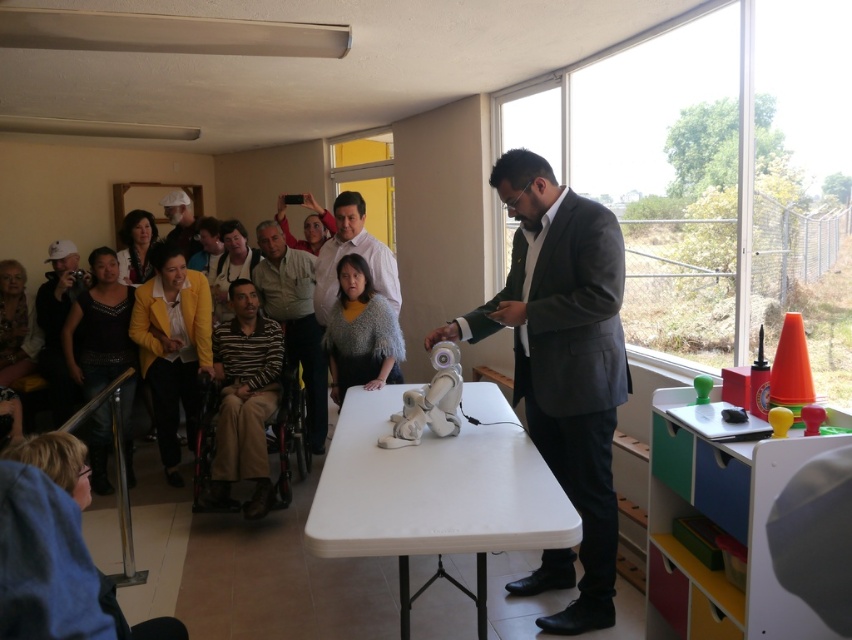
Based on the photo, you are organizing a photo shoot and need to ensure that all participants are visible in the frame. Given that the dark gray suit at center and the striped cotton shirt at center are both in the center, which one might require more space to fully capture in a photograph?

The dark gray suit at center has a larger width than the striped cotton shirt at center, so it would require more space to fully capture in a photograph.

You are a photographer at the event and want to capture a photo of both the striped fabric shirt at center and the matte white cap at upper left in the same frame. Which object should you focus on first to ensure both are in the shot?

The striped fabric shirt at center is positioned on the right side of matte white cap at upper left, so you should focus on the matte white cap at upper left first to ensure both are in the shot.

You are standing in the room where the presentation is happening. You want to hand a document to the person wearing the striped fabric shirt at center. Considering your current position, can you reach them without moving more than 3 meters?

The distance between you and the striped fabric shirt at center is 3.50 meters. Since you can only move 3 meters, you cannot reach them without moving further.